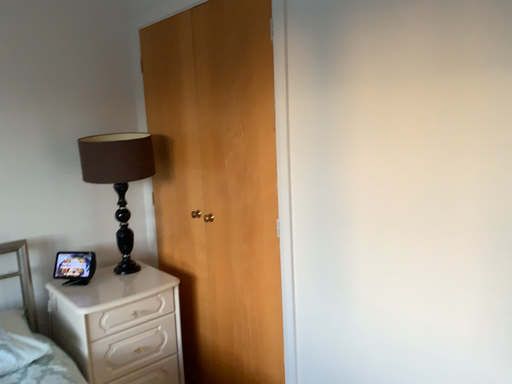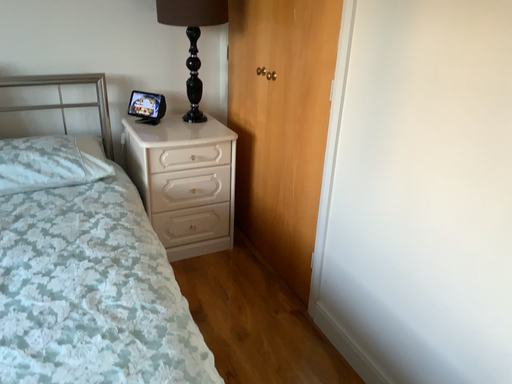
Question: How did the camera likely rotate when shooting the video?

Choices:
 (A) rotated left
 (B) rotated right

Answer: (A)